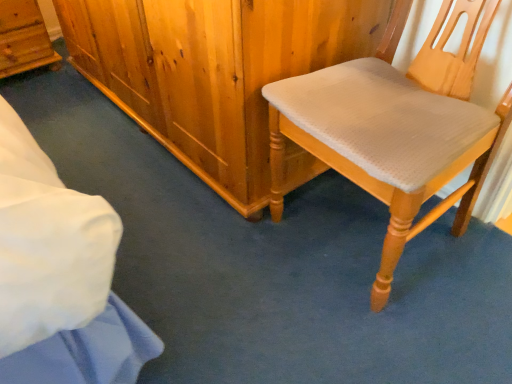
Find the location of a particular element. This screenshot has width=512, height=384. free space in front of light wood/texture chair at right is located at coordinates (385, 330).